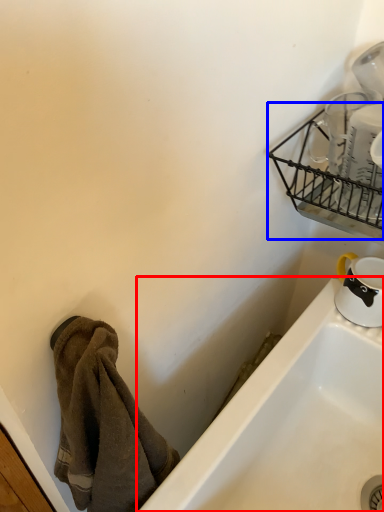
Question: Among these objects, which one is farthest to the camera, bathtub (highlighted by a red box) or basket (highlighted by a blue box)?

Choices:
 (A) bathtub
 (B) basket

Answer: (A)